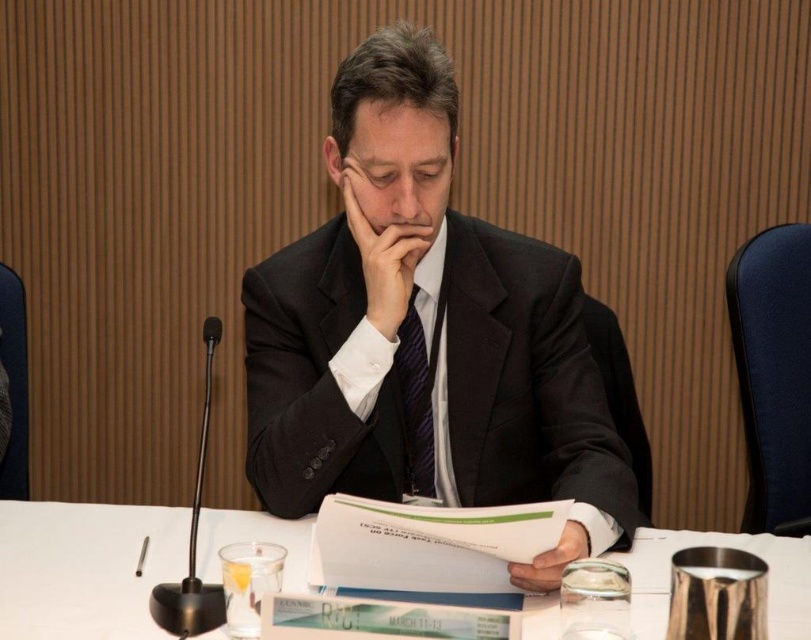
Question: Does dark blue striped tie at center have a smaller size compared to white matte paper at center?

Choices:
 (A) no
 (B) yes

Answer: (A)

Question: Is matte black hand at center in front of dark blue striped tie at center?

Choices:
 (A) yes
 (B) no

Answer: (A)

Question: Can you confirm if matte black suit at center is positioned to the left of white matte paper at center?

Choices:
 (A) yes
 (B) no

Answer: (A)

Question: Which of the following is the farthest from the observer?

Choices:
 (A) pyautogui.click(x=350, y=212)
 (B) pyautogui.click(x=3, y=538)

Answer: (A)

Question: Which object is the closest to the matte black suit at center?

Choices:
 (A) white paper at center
 (B) dark blue striped tie at center

Answer: (B)

Question: Which point is closer to the camera taking this photo?

Choices:
 (A) coord(415,337)
 (B) coord(556,541)

Answer: (B)